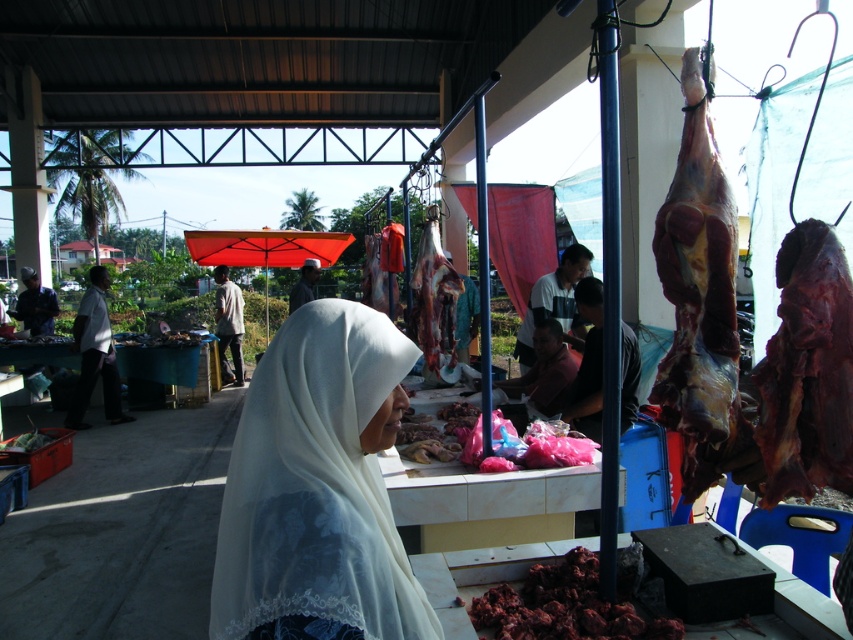
Question: Does raw meat at center have a greater width compared to white matte shirt at center?

Choices:
 (A) yes
 (B) no

Answer: (B)

Question: Which of the following is the closest to the observer?

Choices:
 (A) white sheer headscarf at center
 (B) light brown fabric shirt at center

Answer: (A)

Question: Which object appears farthest from the camera in this image?

Choices:
 (A) white fabric headscarf at center
 (B) dark brown leather jacket at center

Answer: (A)

Question: Does dry brown meat at right appear on the right side of dark brown leather jacket at center?

Choices:
 (A) no
 (B) yes

Answer: (B)

Question: Does pink plastic bags at center appear on the right side of light brown fabric headscarf at center?

Choices:
 (A) yes
 (B) no

Answer: (A)

Question: Estimate the real-world distances between objects in this image. Which object is farther from the light brown fabric headscarf at center?

Choices:
 (A) dark red meat at lower center
 (B) white matte shirt at center
 (C) dark brown leather jacket at center

Answer: (A)